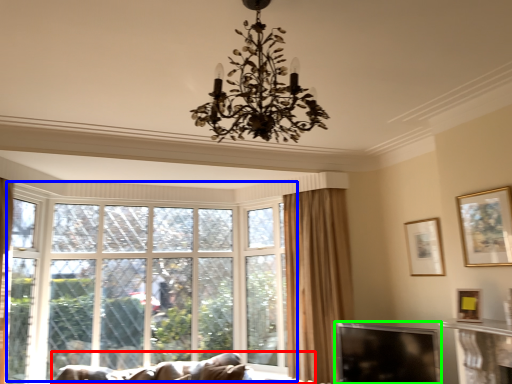
Question: Considering the real-world distances, which object is closest to studio couch (highlighted by a red box)? window (highlighted by a blue box) or window screen (highlighted by a green box).

Choices:
 (A) window
 (B) window screen

Answer: (A)